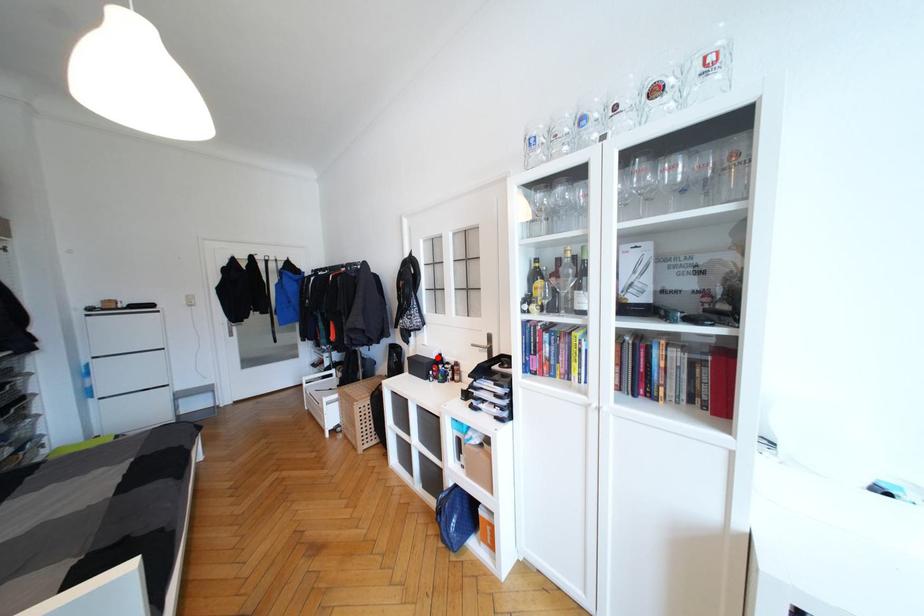
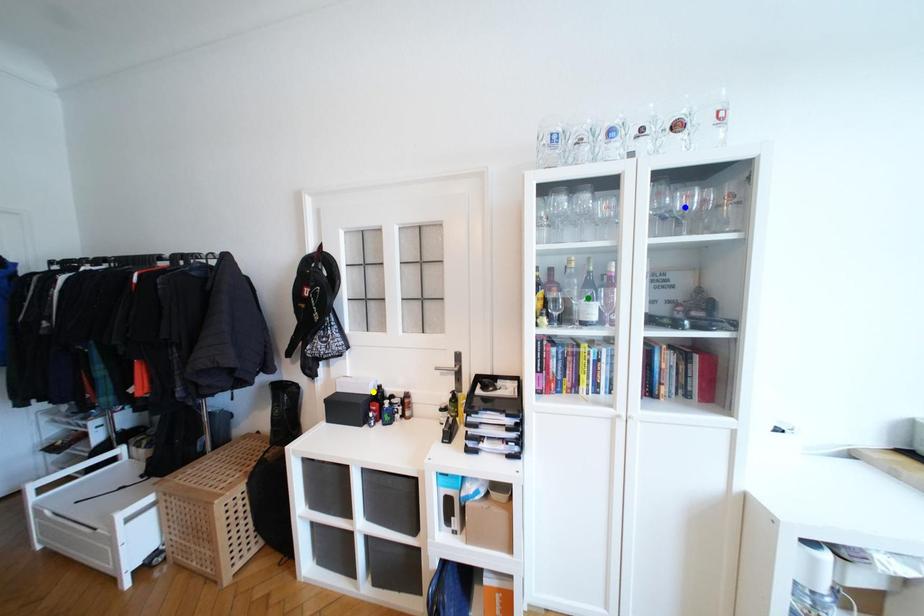
Question: I am providing you with two images of the same scene from different viewpoints. A red point is marked on the first image. You are given multiple points on the second image. Which point in image 2 is actually the same real-world point as the red point in image 1?

Choices:
 (A) yellow point
 (B) green point
 (C) blue point

Answer: (A)